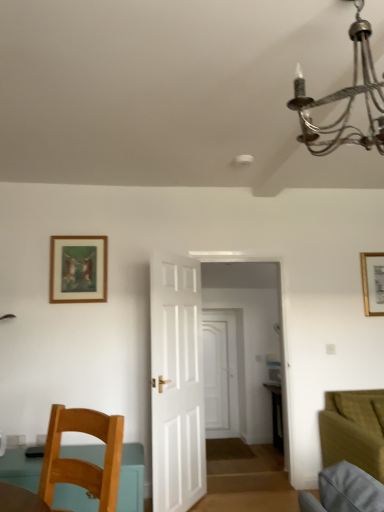
Question: From a real-world perspective, is wooden chair at lower left located higher than white wooden door at center, which appears as the 1th door when viewed from the front?

Choices:
 (A) no
 (B) yes

Answer: (A)

Question: Is wooden chair at lower left aimed at white wooden door at center, placed as the 2th door when sorted from right to left?

Choices:
 (A) no
 (B) yes

Answer: (A)

Question: Is wooden chair at lower left completely or partially outside of white wooden door at center, the 2th door from the back?

Choices:
 (A) yes
 (B) no

Answer: (A)

Question: Is wooden chair at lower left bigger than white wooden door at center, placed as the 2th door when sorted from right to left?

Choices:
 (A) yes
 (B) no

Answer: (B)

Question: Is wooden chair at lower left in front of white wooden door at center, placed as the 2th door when sorted from right to left?

Choices:
 (A) yes
 (B) no

Answer: (A)

Question: From the image's perspective, is white wooden door at center, which appears as the 1th door when viewed from the front, located above or below velvet olive green couch at lower right?

Choices:
 (A) below
 (B) above

Answer: (B)

Question: Based on their sizes in the image, would you say white wooden door at center, placed as the 2th door when sorted from right to left, is bigger or smaller than velvet olive green couch at lower right?

Choices:
 (A) small
 (B) big

Answer: (A)

Question: In the image, is white wooden door at center, which appears as the 1th door when viewed from the front, on the left side or the right side of velvet olive green couch at lower right?

Choices:
 (A) right
 (B) left

Answer: (B)

Question: Considering the positions of white wooden door at center, the 2th door from the back, and velvet olive green couch at lower right in the image, is white wooden door at center, the 2th door from the back, wider or thinner than velvet olive green couch at lower right?

Choices:
 (A) wide
 (B) thin

Answer: (B)

Question: Based on their positions, is wooden chair at lower left located to the left or right of wooden framed artwork at upper left, which ranks as the second picture frame in right-to-left order?

Choices:
 (A) right
 (B) left

Answer: (A)

Question: Considering the positions of point [48, 476] and point [86, 294], is point [48, 476] closer or farther from the camera than point [86, 294]?

Choices:
 (A) closer
 (B) farther

Answer: (A)

Question: Would you say wooden chair at lower left is inside or outside wooden framed artwork at upper left, which ranks as the second picture frame in right-to-left order?

Choices:
 (A) inside
 (B) outside

Answer: (B)

Question: Is wooden chair at lower left in front of or behind wooden framed artwork at upper left, which ranks as the first picture frame in front-to-back order, in the image?

Choices:
 (A) behind
 (B) front

Answer: (B)

Question: From a real-world perspective, relative to wooden framed artwork at upper left, which ranks as the first picture frame in front-to-back order, is velvet olive green couch at lower right vertically above or below?

Choices:
 (A) above
 (B) below

Answer: (B)

Question: In terms of size, does velvet olive green couch at lower right appear bigger or smaller than wooden framed artwork at upper left, which is counted as the 1th picture frame, starting from the left?

Choices:
 (A) small
 (B) big

Answer: (B)